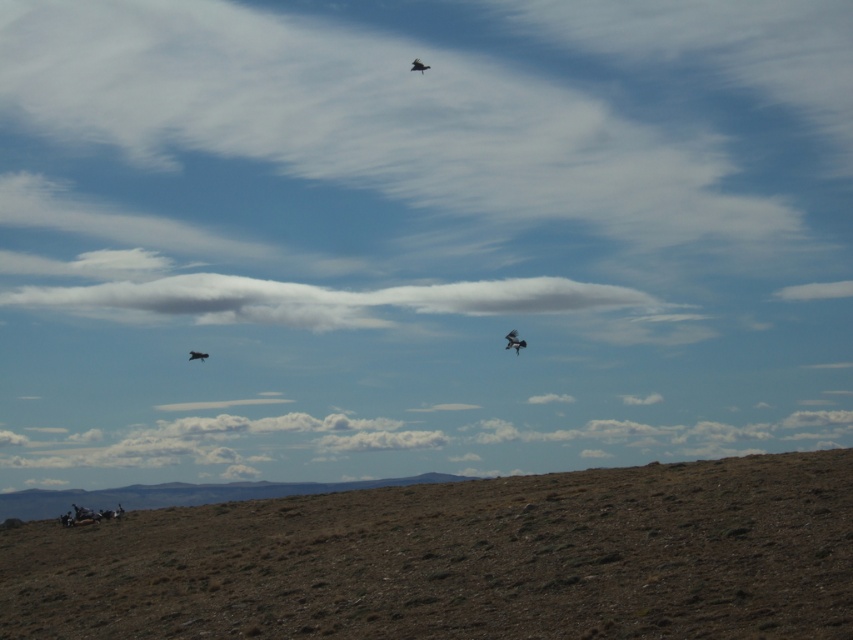
From the picture: You are standing at the origin point of the coordinate system and want to reach the brown dirt hillside at lower center. What are the coordinates you need to move to?

The coordinates to reach the brown dirt hillside at lower center are point (463, 560).

Looking at this image, you are an airplane pilot flying at a high altitude. You notice two objects in the sky ahead of you. One is the white fluffy cloud at center and the other is the dark brown feathers at upper center. Which object is closer to your plane?

The white fluffy cloud at center is closer to your plane because the dark brown feathers at upper center is behind it, meaning the cloud is in front.

You are an airplane pilot flying at a high altitude. You notice two objects in the sky ahead of you. One is the white fluffy cloud at center and the other is the dark brown feathers at upper center. Which object would block your view more if you were to fly through them?

The white fluffy cloud at center would block your view more than the dark brown feathers at upper center because it is larger in size.